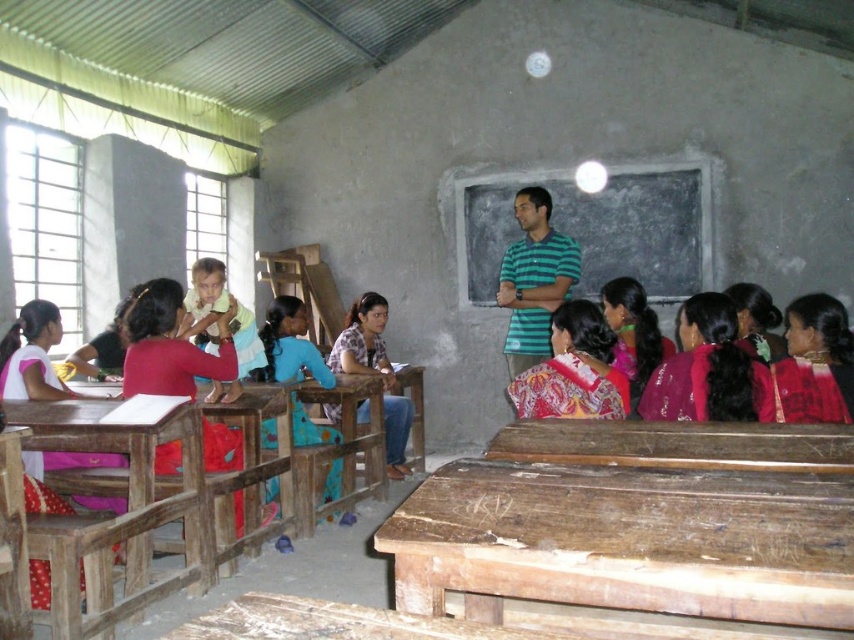
You are a student sitting at the wooden table at center in a classroom. You notice a patterned fabric dress at center that you want to hand back to its owner. Can you reach it from your current position without leaving your seat?

The wooden table at center is 32.89 inches away from the patterned fabric dress at center. Since this distance is relatively short, you can likely reach the patterned fabric dress at center from your seated position without needing to leave your seat.

You are a teacher in the classroom and want to place a 1.2 meter wide poster on the wooden table at center. Can the poster fit on the table if the patterned fabric dress at center is already occupying the table?

The wooden table at center is wider than the patterned fabric dress at center, so there should be enough space for the 1.2 meter wide poster if the dress is not taking up the entire table surface. However, since the exact dimensions of the table and dress are not provided, it is recommended to measure the available space before placing the poster.